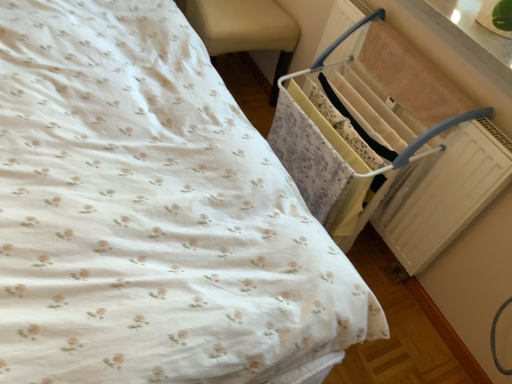
Looking at this image, in order to face beige fabric chair at upper right, should I rotate leftwards or rightwards?

To align with it, rotate left about 3.953°.

What do you see at coordinates (244, 29) in the screenshot?
I see `beige fabric chair at upper right` at bounding box center [244, 29].

What are the coordinates of `beige fabric chair at upper right` in the screenshot? It's located at (244, 29).

At what (x,y) coordinates should I click in order to perform the action: click on beige fabric chair at upper right. Please return your answer as a coordinate pair (x, y). Looking at the image, I should click on (244, 29).